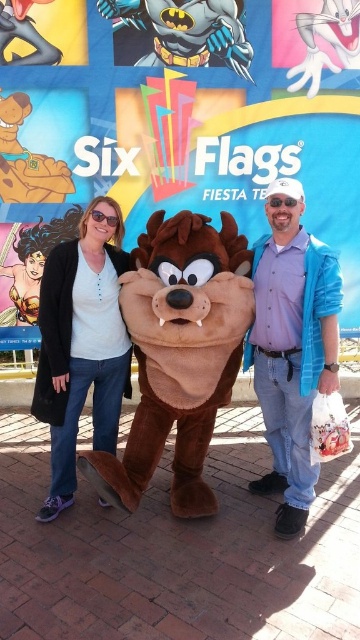
You are standing in front of the Six Flags Fiesta Texas backdrop and see two points marked in the image. Which point is closer to you, point (186, 317) or point (298, 326)?

Point (186, 317) is closer to the viewer than point (298, 326).

You are standing in front of the Six Flags Fiesta Texas backdrop. There is a Tazmanian Devil mascot at center. Where is the Tazmanian Devil mascot located in relation to the point marked at coordinates [180,356]?

The brown plush at center, which represents the Tazmanian Devil mascot, is exactly at the point marked by coordinates [180,356].